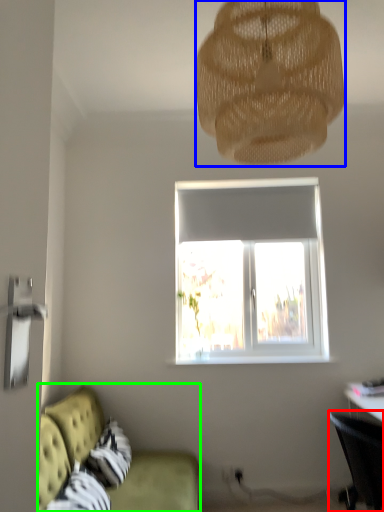
Question: Considering the real-world distances, which object is farthest from chair (highlighted by a red box)? lamp (highlighted by a blue box) or studio couch (highlighted by a green box)?

Choices:
 (A) lamp
 (B) studio couch

Answer: (A)